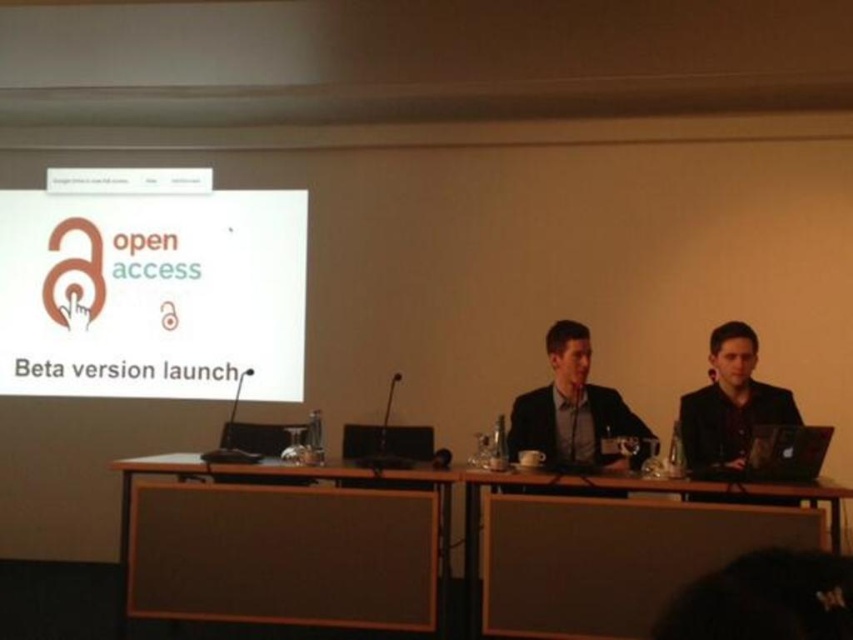
Consider the image. You are sitting in the conference room and need to reach the dark brown suit at right to hand a document. The wooden table at center is between you and the suit. Can you directly hand the document without moving around the table?

The wooden table at center is closer to the viewer than the dark brown suit at right, so you cannot directly hand the document without moving around the table because the table is in the way.

You are organizing a small event and need to place a 20 inch wide decorative item between the brown fabric table at center and the wooden table at center. Is there enough space to place it without moving either table?

The distance between the brown fabric table at center and the wooden table at center is 34.20 inches. Since the decorative item is 20 inches wide, there is sufficient space to place it between them without moving either table.